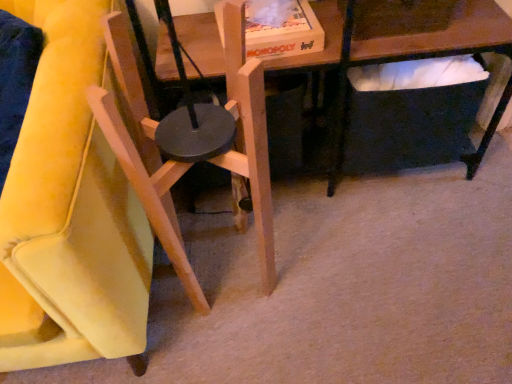
Identify the location of spots to the right of natural wood chair at center, which is the second chair from left to right. The width and height of the screenshot is (512, 384). (316, 255).